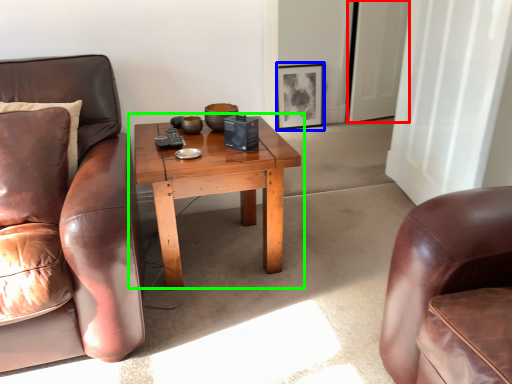
Question: Which is nearer to the glass door (highlighted by a red box)? picture frame (highlighted by a blue box) or coffee table (highlighted by a green box).

Choices:
 (A) picture frame
 (B) coffee table

Answer: (A)